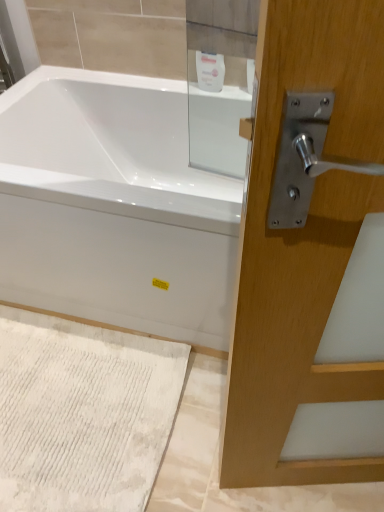
Question: Based on their sizes in the image, would you say white textured bath mat at lower left is bigger or smaller than white glossy bathtub at center?

Choices:
 (A) small
 (B) big

Answer: (A)

Question: Does point (147, 394) appear closer or farther from the camera than point (153, 138)?

Choices:
 (A) farther
 (B) closer

Answer: (B)

Question: Which is nearer to the white glossy soap dispenser at upper center?

Choices:
 (A) white glossy bathtub at center
 (B) white textured bath mat at lower left

Answer: (A)

Question: Estimate the real-world distances between objects in this image. Which object is farther from the white glossy soap dispenser at upper center?

Choices:
 (A) white glossy bathtub at center
 (B) white textured bath mat at lower left

Answer: (B)